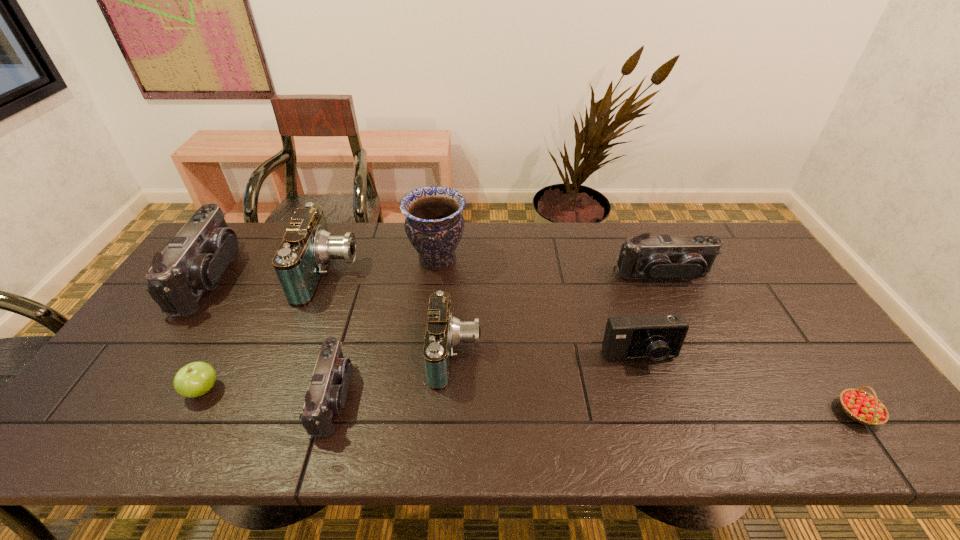
Identify the location of the shortest camcorder. This screenshot has width=960, height=540. (326, 395).

What are the coordinates of `the smallest black camcorder` in the screenshot? It's located at (326, 395).

What are the coordinates of `apple` in the screenshot? It's located at (195, 379).

Locate an element on the screen. the second object from left to right is located at coordinates (195, 379).

At what (x,y) coordinates should I click in order to perform the action: click on strawberry. Please return your answer as a coordinate pair (x, y). This screenshot has height=540, width=960. Looking at the image, I should click on (862, 407).

Identify the location of the shortest object. The height and width of the screenshot is (540, 960). (862, 407).

The width and height of the screenshot is (960, 540). Identify the location of blank space located 0.380m on the front handle of the pottery. (584, 259).

Where is `blank space located 0.130m on the front-facing side of the bigger blue camcorder`? blank space located 0.130m on the front-facing side of the bigger blue camcorder is located at coordinates (398, 273).

Find the location of `free location located 0.290m on the front-facing side of the leftmost black camcorder`. free location located 0.290m on the front-facing side of the leftmost black camcorder is located at coordinates (325, 278).

You are a GUI agent. You are given a task and a screenshot of the screen. Output one action in this format:
    pyautogui.click(x=<x>, y=<y>)
    Task: Click on the vacant space positioned 0.230m on the front-facing side of the rightmost black camcorder
    The height and width of the screenshot is (540, 960).
    Given the screenshot: What is the action you would take?
    pyautogui.click(x=696, y=346)